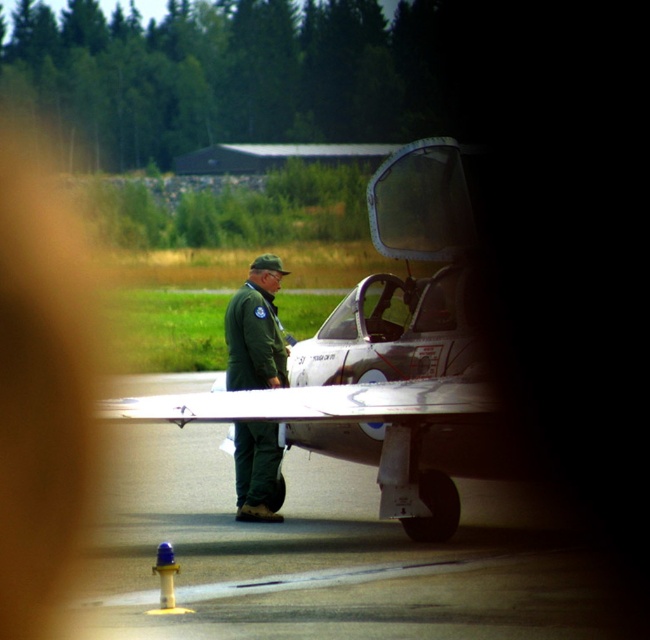
Question: Which object is positioned farthest from the green matte uniform at center?

Choices:
 (A) silver metallic jet at center
 (B) smooth asphalt tarmac at center

Answer: (B)

Question: Does smooth asphalt tarmac at center appear under silver metallic jet at center?

Choices:
 (A) no
 (B) yes

Answer: (B)

Question: Does smooth asphalt tarmac at center lie behind green matte uniform at center?

Choices:
 (A) yes
 (B) no

Answer: (B)

Question: Which point appears farthest from the camera in this image?

Choices:
 (A) (254, 284)
 (B) (372, 326)

Answer: (A)

Question: Does silver metallic jet at center have a larger size compared to green matte uniform at center?

Choices:
 (A) no
 (B) yes

Answer: (B)

Question: Which of the following is the farthest from the observer?

Choices:
 (A) silver metallic jet at center
 (B) smooth asphalt tarmac at center
 (C) green matte uniform at center

Answer: (C)